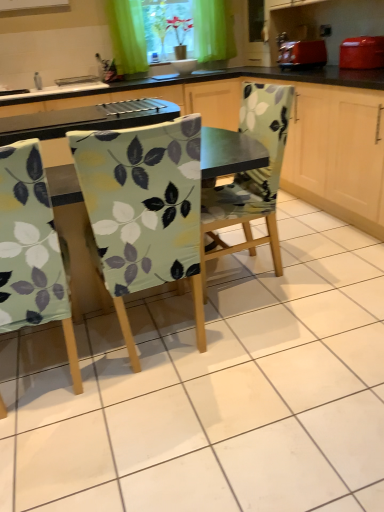
Question: Can you confirm if floral fabric chair at center, the first chair viewed from the right, is thinner than matte red toaster at upper right?

Choices:
 (A) no
 (B) yes

Answer: (A)

Question: Is floral fabric chair at center, acting as the third chair starting from the left, far from matte red toaster at upper right?

Choices:
 (A) no
 (B) yes

Answer: (B)

Question: Is floral fabric chair at center, the first chair viewed from the right, shorter than matte red toaster at upper right?

Choices:
 (A) yes
 (B) no

Answer: (B)

Question: From a real-world perspective, is floral fabric chair at center, acting as the third chair starting from the left, positioned over matte red toaster at upper right based on gravity?

Choices:
 (A) yes
 (B) no

Answer: (B)

Question: Could you tell me if floral fabric chair at center, acting as the third chair starting from the left, is facing matte red toaster at upper right?

Choices:
 (A) yes
 (B) no

Answer: (B)

Question: Considering the positions of white glossy sink at upper left, positioned as the second sink in top-to-bottom order, and green fabric chair at center in the image, is white glossy sink at upper left, positioned as the second sink in top-to-bottom order, bigger or smaller than green fabric chair at center?

Choices:
 (A) small
 (B) big

Answer: (A)

Question: Is white glossy sink at upper left, positioned as the second sink in top-to-bottom order, wider or thinner than green fabric chair at center?

Choices:
 (A) wide
 (B) thin

Answer: (B)

Question: Do you think white glossy sink at upper left, positioned as the second sink in top-to-bottom order, is within green fabric chair at center, or outside of it?

Choices:
 (A) inside
 (B) outside

Answer: (B)

Question: In terms of height, does white glossy sink at upper left, the 1th sink in the left-to-right sequence, look taller or shorter compared to green fabric chair at center?

Choices:
 (A) tall
 (B) short

Answer: (B)

Question: Is white glossy bowl at upper center, which is the 2th sink from bottom to top, in front of or behind green fabric chair at center in the image?

Choices:
 (A) behind
 (B) front

Answer: (A)

Question: Does point (215, 66) appear closer or farther from the camera than point (372, 167)?

Choices:
 (A) closer
 (B) farther

Answer: (B)

Question: Is white glossy bowl at upper center, which is the 2th sink from bottom to top, taller or shorter than green fabric chair at center?

Choices:
 (A) short
 (B) tall

Answer: (A)

Question: Considering the relative positions of white glossy bowl at upper center, marked as the first sink in a top-to-bottom arrangement, and green fabric chair at center in the image provided, is white glossy bowl at upper center, marked as the first sink in a top-to-bottom arrangement, to the left or to the right of green fabric chair at center?

Choices:
 (A) right
 (B) left

Answer: (B)

Question: Is point (157, 31) closer or farther from the camera than point (205, 72)?

Choices:
 (A) closer
 (B) farther

Answer: (B)

Question: Is green fabric at upper center wider or thinner than white glossy bowl at upper center, which is the 2th sink from bottom to top?

Choices:
 (A) wide
 (B) thin

Answer: (A)